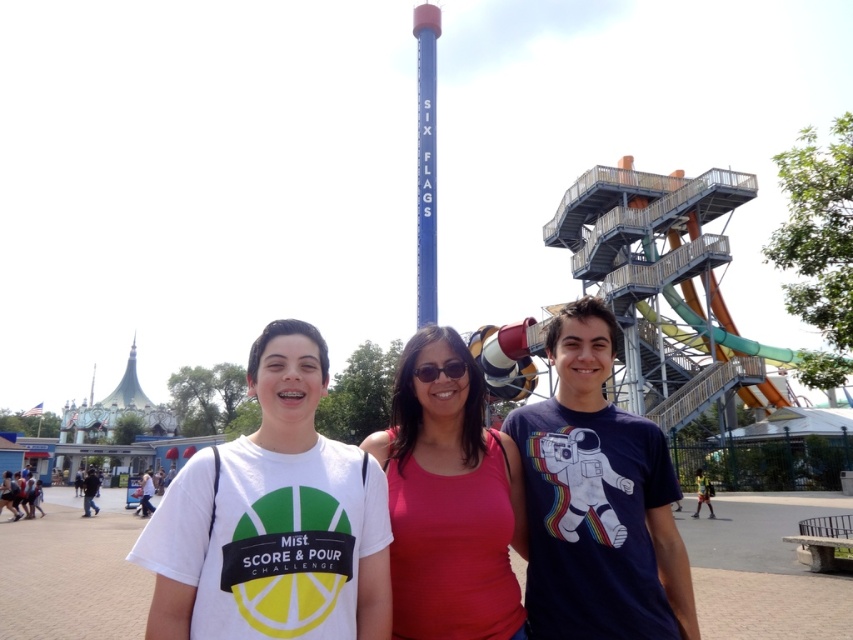
The width and height of the screenshot is (853, 640). What do you see at coordinates (426, 161) in the screenshot?
I see `blue metallic pole at center` at bounding box center [426, 161].

Can you confirm if blue metallic pole at center is bigger than black plastic sunglasses at center?

Yes, blue metallic pole at center is bigger than black plastic sunglasses at center.

Where is `blue metallic pole at center`? This screenshot has width=853, height=640. blue metallic pole at center is located at coordinates (426, 161).

Is red matte tank top at center above blue metallic pole at center?

Actually, red matte tank top at center is below blue metallic pole at center.

Does red matte tank top at center appear on the right side of blue metallic pole at center?

Correct, you'll find red matte tank top at center to the right of blue metallic pole at center.

Who is more distant from viewer, [479,493] or [428,237]?

Point [428,237]

Identify the location of red matte tank top at center. Image resolution: width=853 pixels, height=640 pixels. (448, 502).

This screenshot has width=853, height=640. What do you see at coordinates (448, 502) in the screenshot? I see `red matte tank top at center` at bounding box center [448, 502].

Is red matte tank top at center above black plastic sunglasses at center?

Actually, red matte tank top at center is below black plastic sunglasses at center.

Is point (425, 577) farther from camera compared to point (440, 369)?

No, it is not.

The height and width of the screenshot is (640, 853). In order to click on red matte tank top at center in this screenshot , I will do `click(448, 502)`.